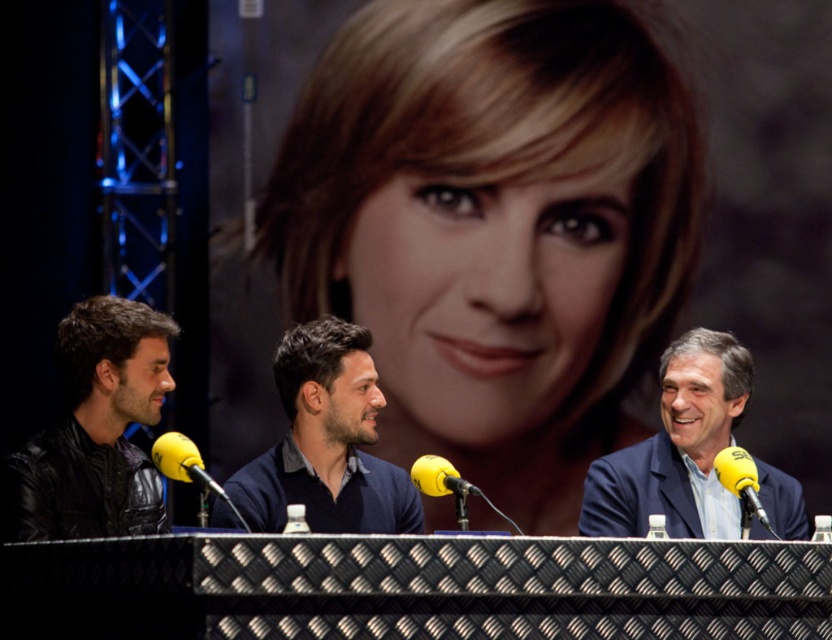
You are a photographer at the panel discussion. You need to capture a clear shot of the dark blue sweater at center without the black leather jacket at left blocking it. How should you adjust your camera position?

Move your camera position behind the black leather jacket at left so that the dark blue sweater at center becomes visible without obstruction.

Consider the image. You are organizing a photoshoot and need to place a 1.2 meter wide backdrop behind the black leather jacket at left and the dark blue sweater at center. Will the backdrop be wide enough to cover both items?

The black leather jacket at left has a lesser width compared to dark blue sweater at center. Since the total width of both items combined would be more than 1.2 meters, the backdrop may not be wide enough to cover both items fully.